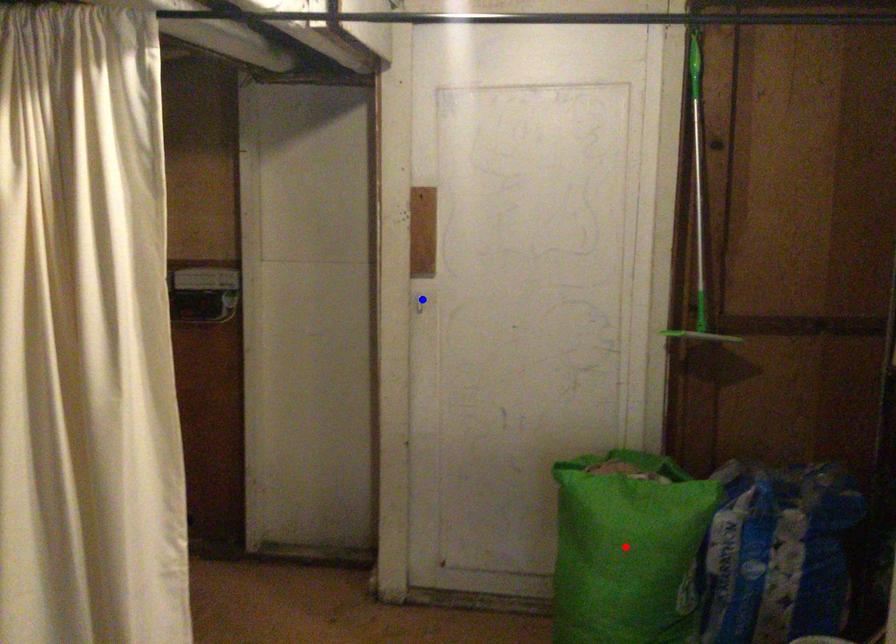
Question: Two points are marked on the image. Which point is closer to the camera?

Choices:
 (A) Blue point is closer.
 (B) Red point is closer.

Answer: (B)